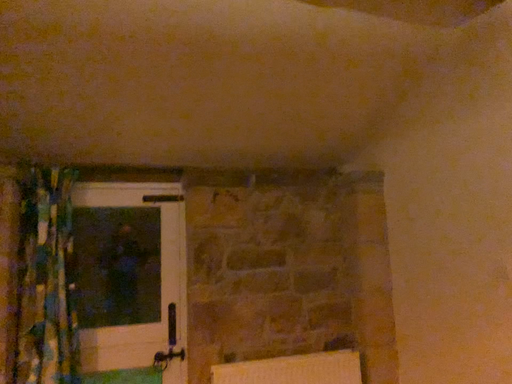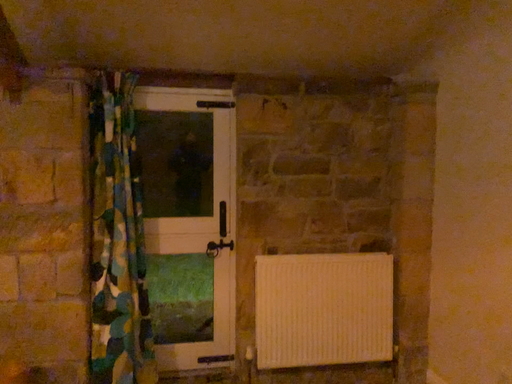
Question: Which way did the camera rotate in the video?

Choices:
 (A) rotated downward
 (B) rotated upward

Answer: (A)